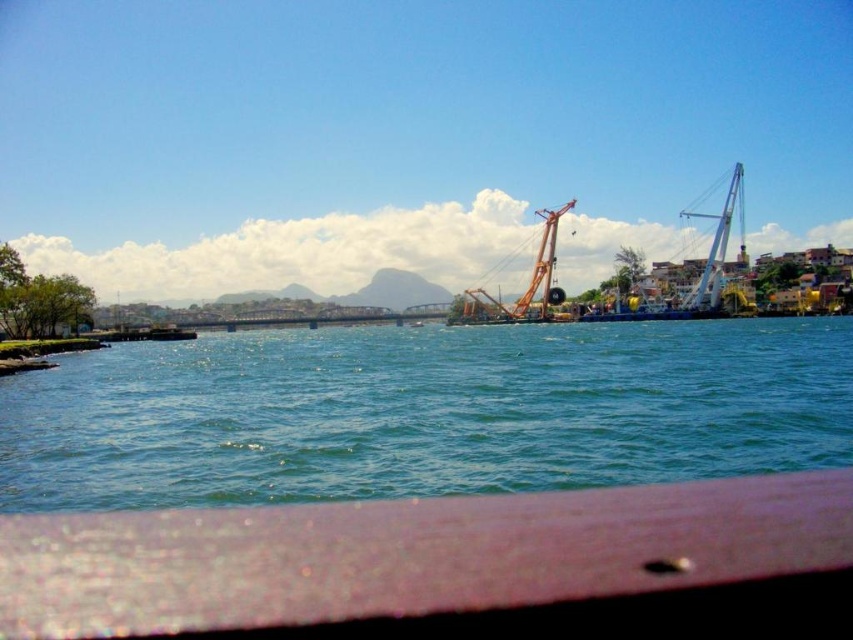
Question: Does white metallic crane at right have a greater width compared to orange metallic crane at center?

Choices:
 (A) no
 (B) yes

Answer: (B)

Question: Which point is farther to the camera?

Choices:
 (A) (223, 486)
 (B) (519, 300)
 (C) (738, 182)

Answer: (C)

Question: Which of the following is the closest to the observer?

Choices:
 (A) (532, 305)
 (B) (285, 385)
 (C) (706, 301)

Answer: (B)

Question: Can you confirm if white metallic crane at right is positioned below orange metallic crane at center?

Choices:
 (A) yes
 (B) no

Answer: (B)

Question: Which of these objects is positioned farthest from the white metallic crane at right?

Choices:
 (A) green water at center
 (B) orange metallic crane at center

Answer: (A)

Question: Where is green water at center located in relation to white metallic crane at right in the image?

Choices:
 (A) left
 (B) right

Answer: (A)